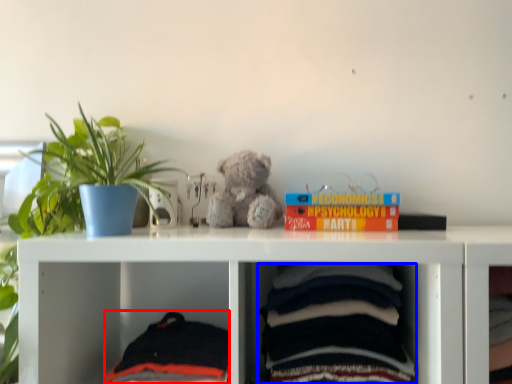
Question: Among these objects, which one is nearest to the camera, baby clothe (highlighted by a red box) or baby clothe (highlighted by a blue box)?

Choices:
 (A) baby clothe
 (B) baby clothe

Answer: (B)